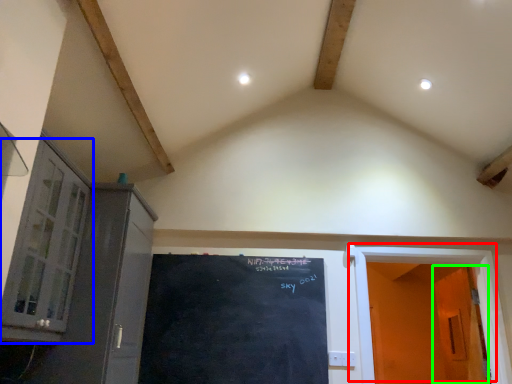
Question: Which object is positioned farthest from door (highlighted by a red box)? Select from window (highlighted by a blue box) and door (highlighted by a green box).

Choices:
 (A) window
 (B) door

Answer: (A)